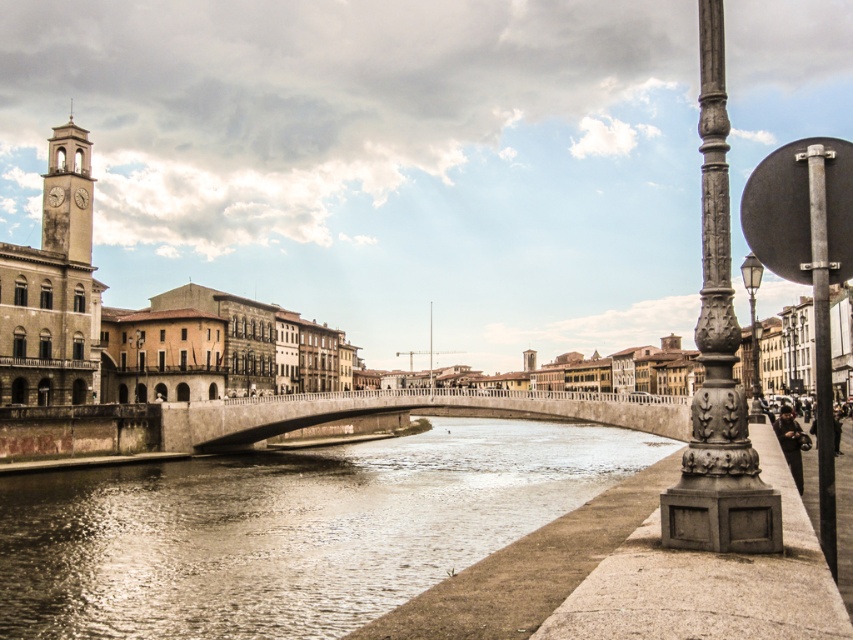
Question: Where is brown concrete river at center located in relation to antique brass streetlamp at right in the image?

Choices:
 (A) right
 (B) left

Answer: (B)

Question: Which object appears closest to the camera in this image?

Choices:
 (A) brown concrete river at center
 (B) antique brass streetlamp at right

Answer: (A)

Question: Is stone clock tower at upper left wider than polished metal pole at center?

Choices:
 (A) no
 (B) yes

Answer: (B)

Question: Which of these objects is positioned farthest from the brown concrete river at center?

Choices:
 (A) polished metal pole at center
 (B) smooth stone bridge at center
 (C) dark gray ornate pole at right

Answer: (A)

Question: Can you confirm if dark gray ornate pole at right is wider than antique brass streetlamp at right?

Choices:
 (A) no
 (B) yes

Answer: (A)

Question: Based on their relative distances, which object is nearer to the smooth stone bridge at center?

Choices:
 (A) dark gray ornate pole at right
 (B) brown concrete river at center
 (C) antique brass streetlamp at right

Answer: (B)